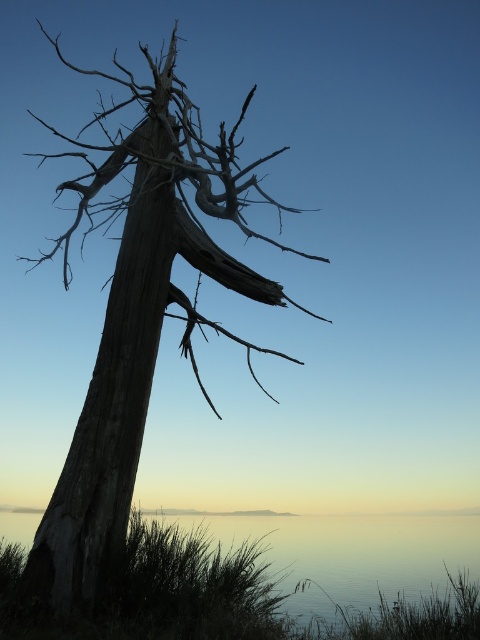
Question: Does gray textured wood at left come in front of smooth glass water at lower center?

Choices:
 (A) no
 (B) yes

Answer: (B)

Question: Is gray textured wood at left wider than smooth glass water at lower center?

Choices:
 (A) yes
 (B) no

Answer: (B)

Question: Which object appears closest to the camera in this image?

Choices:
 (A) gray textured wood at left
 (B) smooth glass water at lower center
 (C) gray rough bark tree trunk at left

Answer: (A)

Question: Which of the following is the closest to the observer?

Choices:
 (A) smooth glass water at lower center
 (B) gray rough bark tree trunk at left
 (C) gray textured wood at left

Answer: (C)

Question: Which of the following is the farthest from the observer?

Choices:
 (A) (94, 387)
 (B) (126, 433)

Answer: (A)

Question: Is gray textured wood at left positioned behind smooth glass water at lower center?

Choices:
 (A) no
 (B) yes

Answer: (A)